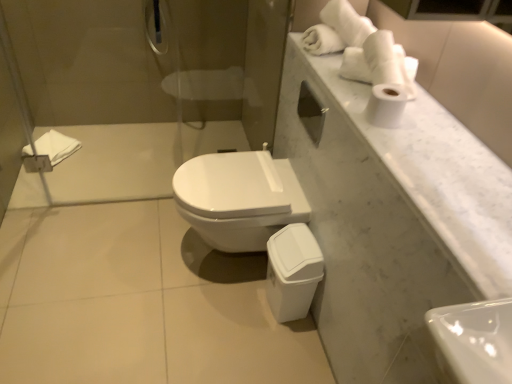
The height and width of the screenshot is (384, 512). In order to click on free spot above white glossy toilet at center (from a real-world perspective) in this screenshot , I will do `click(217, 167)`.